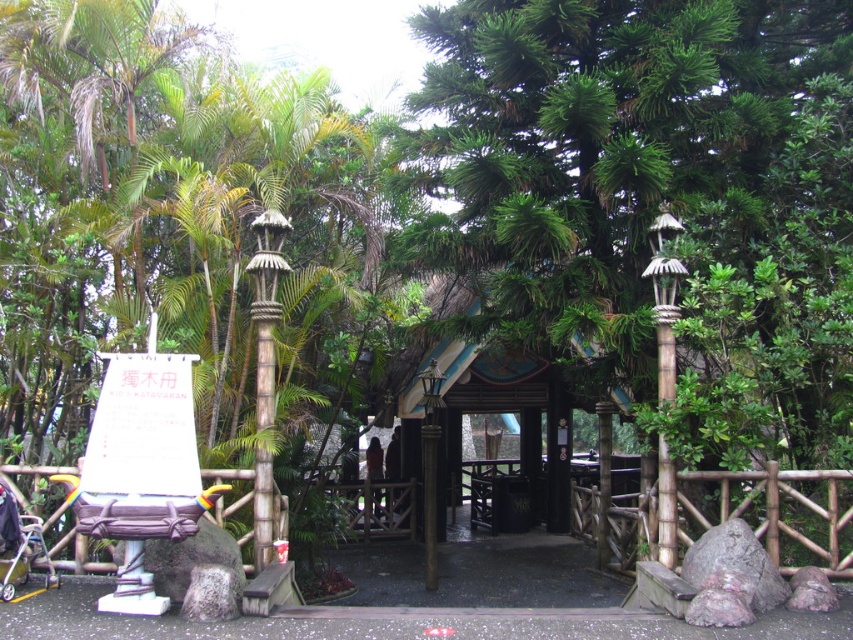
You are a parent pushing a metallic silver baby carriage at lower left and want to sit down on the matte purple chair at center. Is the height of the chair sufficient to comfortably place the baby from the carriage onto the chair?

The matte purple chair at center has a greater height compared to metallic silver baby carriage at lower left, so yes, the chair is tall enough to comfortably place the baby from the carriage onto the chair.